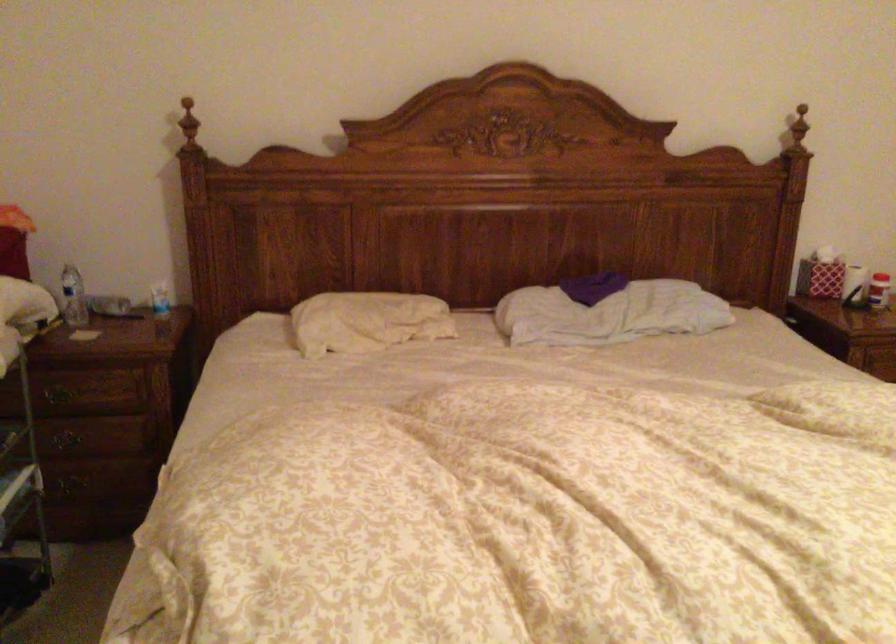
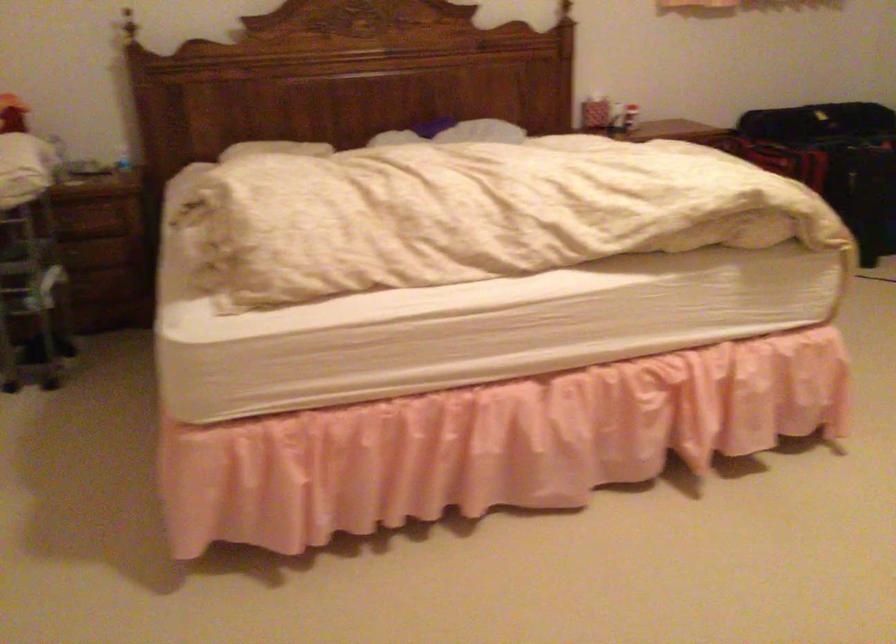
Where in the second image is the point corresponding to (806,292) from the first image?

(590, 109)